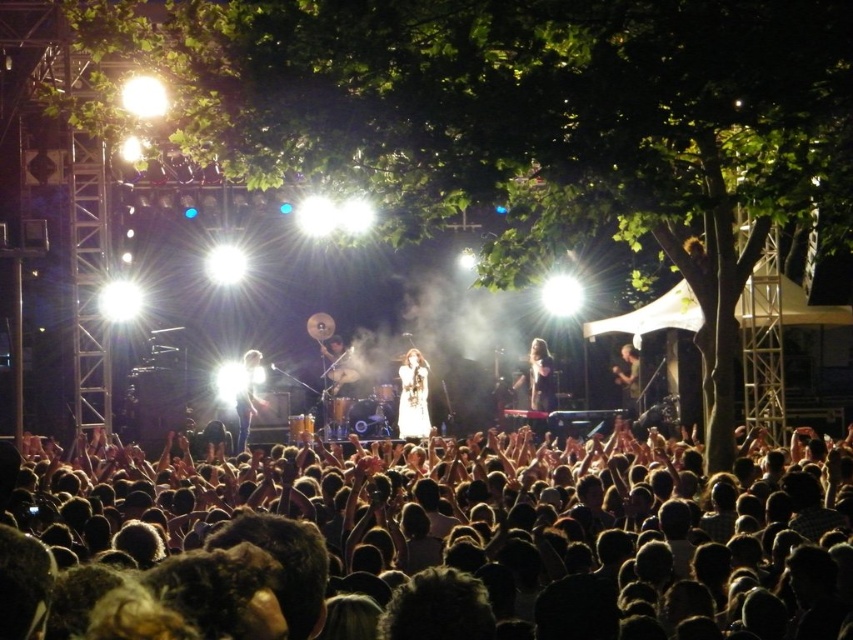
Who is more forward, (x=515, y=566) or (x=239, y=378)?

Point (x=515, y=566) is more forward.

At what (x,y) coordinates should I click in order to perform the action: click on dark brown hair at lower center. Please return your answer as a coordinate pair (x, y). This screenshot has width=853, height=640. Looking at the image, I should click on (428, 545).

Between dark brown hair at lower center and dark brown leather jacket at right, which one has less height?

With less height is dark brown leather jacket at right.

The image size is (853, 640). I want to click on dark brown hair at lower center, so click(428, 545).

Which is below, long hair at center or shiny silver microphone at center?

shiny silver microphone at center is below.

Does long hair at center have a larger size compared to shiny silver microphone at center?

Yes.

Does point (550, 365) come behind point (242, 420)?

Yes, it is behind point (242, 420).

The image size is (853, 640). I want to click on long hair at center, so pos(538,378).